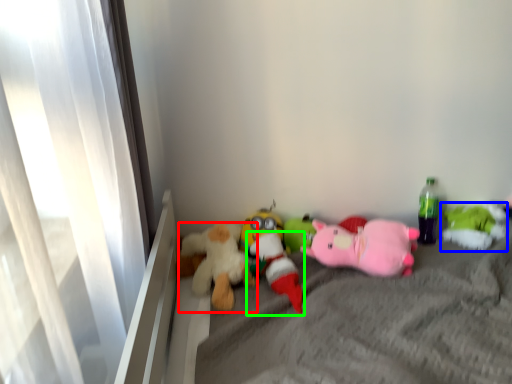
Question: Which object is positioned farthest from toy (highlighted by a red box)? Select from toy (highlighted by a blue box) and toy (highlighted by a green box).

Choices:
 (A) toy
 (B) toy

Answer: (A)